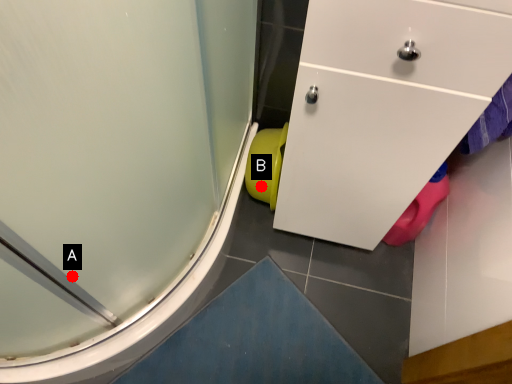
Question: Two points are circled on the image, labeled by A and B beside each circle. Among these points, which one is nearest to the camera?

Choices:
 (A) A is closer
 (B) B is closer

Answer: (A)